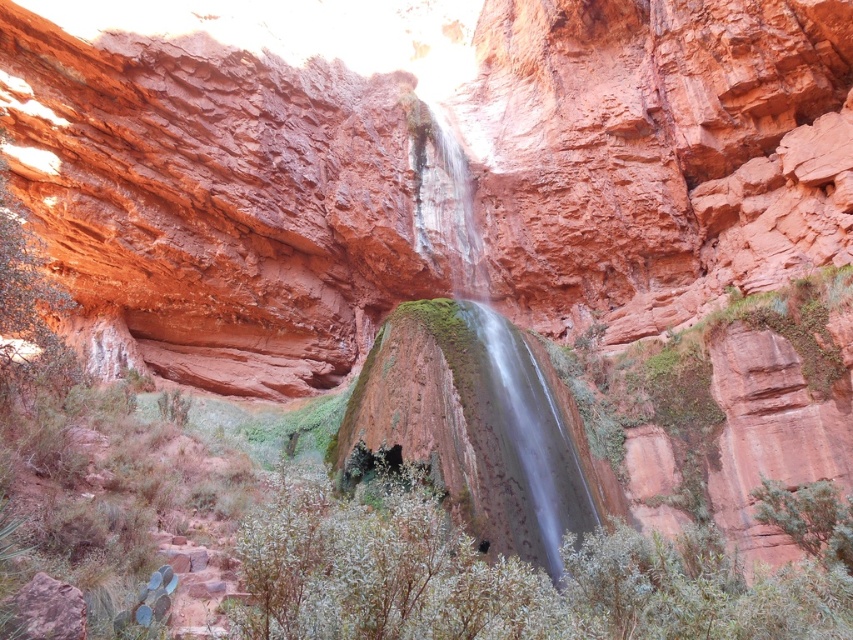
You are a hiker who wants to take a photo of the smooth rock waterfall at center from the green leafy shrubs at center. Will the shrubs block your view of the waterfall?

The green leafy shrubs at center are shorter than the smooth rock waterfall at center, so they will not block your view of the waterfall.